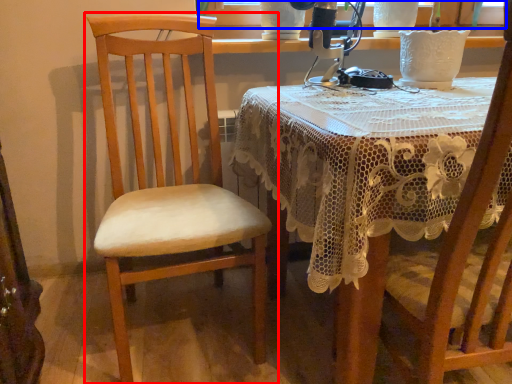
Question: Which of the following is the farthest to the observer, chair (highlighted by a red box) or window screen (highlighted by a blue box)?

Choices:
 (A) chair
 (B) window screen

Answer: (B)